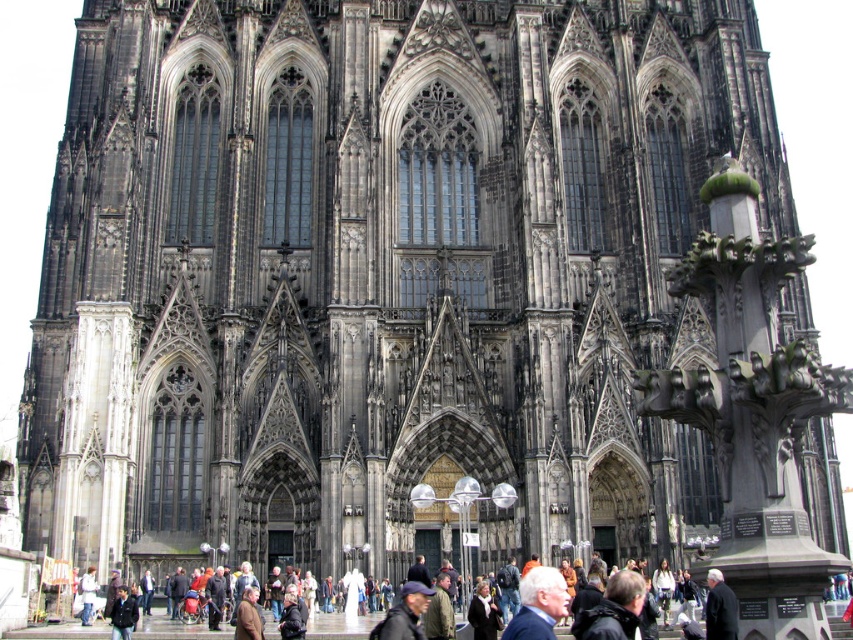
Looking at this image, which is below, blue fabric jacket at lower center or dark brown leather jacket at lower left?

Positioned lower is dark brown leather jacket at lower left.

Is the position of blue fabric jacket at lower center less distant than that of dark brown leather jacket at lower left?

Yes, it is.

Does point (554, 579) come closer to viewer compared to point (131, 620)?

Yes, it is in front of point (131, 620).

This screenshot has height=640, width=853. What are the coordinates of `blue fabric jacket at lower center` in the screenshot? It's located at [x=538, y=605].